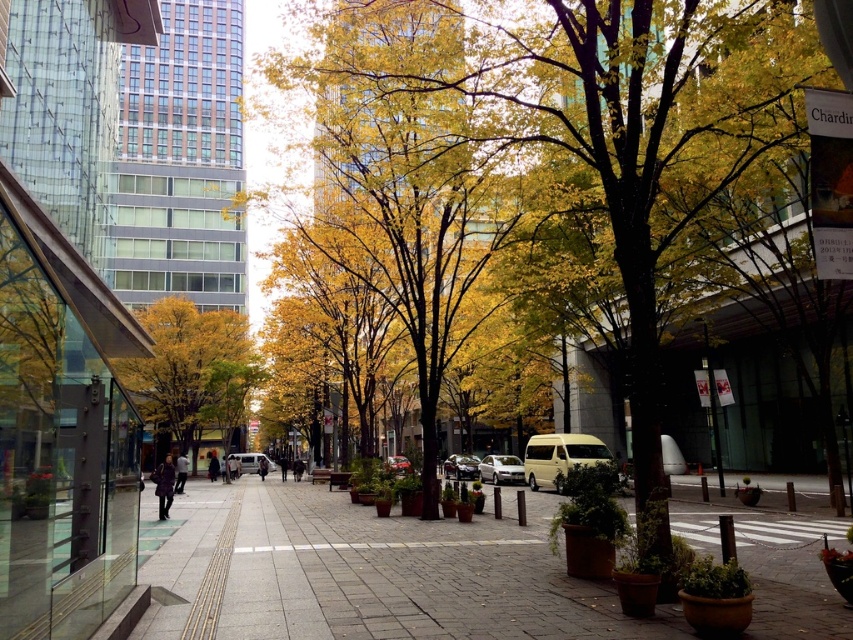
Question: Is yellow-green foliage at center positioned at the back of shiny silver car at center?

Choices:
 (A) yes
 (B) no

Answer: (B)

Question: Considering the real-world distances, which object is closest to the matte silver van at center?

Choices:
 (A) smooth concrete pavement at center
 (B) shiny red car at center
 (C) yellow/golden wood at center

Answer: (C)

Question: Where is shiny silver car at center located in relation to shiny red car at center in the image?

Choices:
 (A) above
 (B) below

Answer: (B)

Question: Among these points, which one is nearest to the camera?

Choices:
 (A) 407,461
 (B) 492,483

Answer: (A)

Question: Can you confirm if smooth concrete pavement at center is positioned to the right of matte silver van at center?

Choices:
 (A) yes
 (B) no

Answer: (A)

Question: Which object appears farthest from the camera in this image?

Choices:
 (A) matte silver van at center
 (B) yellow-green foliage at center
 (C) shiny silver car at center
 (D) shiny red car at center

Answer: (A)